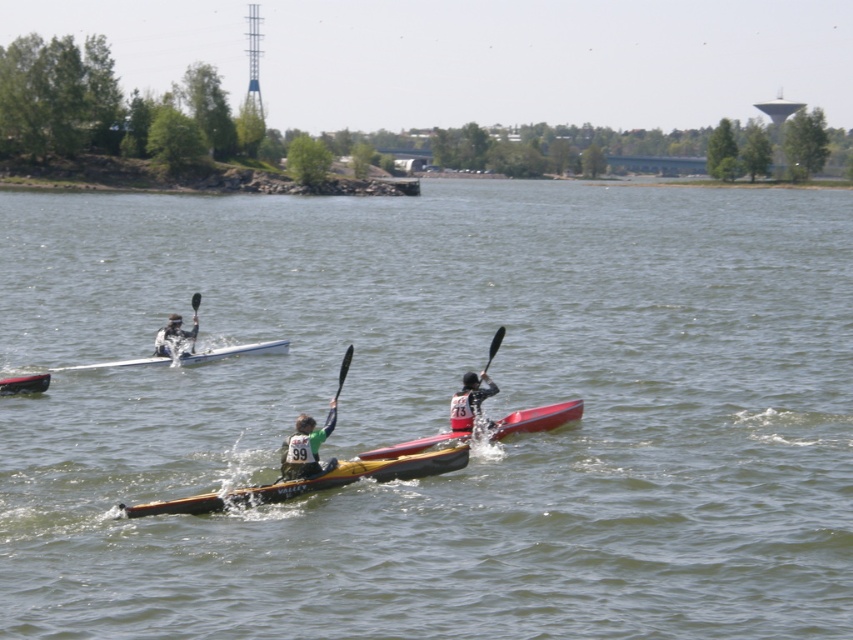
Question: Among these points, which one is farthest from the camera?

Choices:
 (A) (71, 369)
 (B) (294, 456)
 (C) (503, 419)

Answer: (A)

Question: Among these objects, which one is farthest from the camera?

Choices:
 (A) green fabric kayak at center
 (B) black plastic paddle at center
 (C) matte yellow kayak at center
 (D) green matte kayak at center

Answer: (A)

Question: Does yellow plastic canoe at center have a larger size compared to black plastic paddle at center?

Choices:
 (A) yes
 (B) no

Answer: (B)

Question: Does yellow matte kayak at center have a lesser width compared to green matte kayak at center?

Choices:
 (A) no
 (B) yes

Answer: (A)

Question: Can you confirm if yellow matte kayak at center is positioned to the left of green matte kayak at center?

Choices:
 (A) yes
 (B) no

Answer: (A)

Question: Which point is farther from the camera taking this photo?

Choices:
 (A) (173, 314)
 (B) (163, 360)
 (C) (303, 420)

Answer: (A)